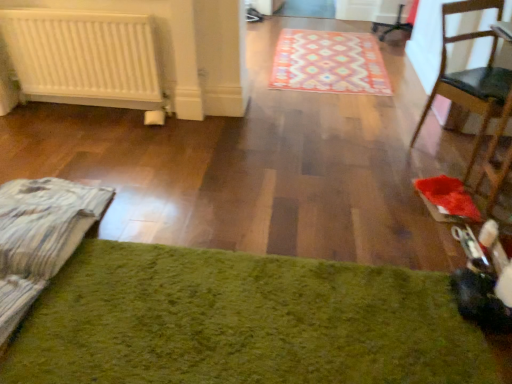
Find the location of a particular element. The height and width of the screenshot is (384, 512). vacant space underneath wooden chair at right (from a real-world perspective) is located at coordinates (451, 145).